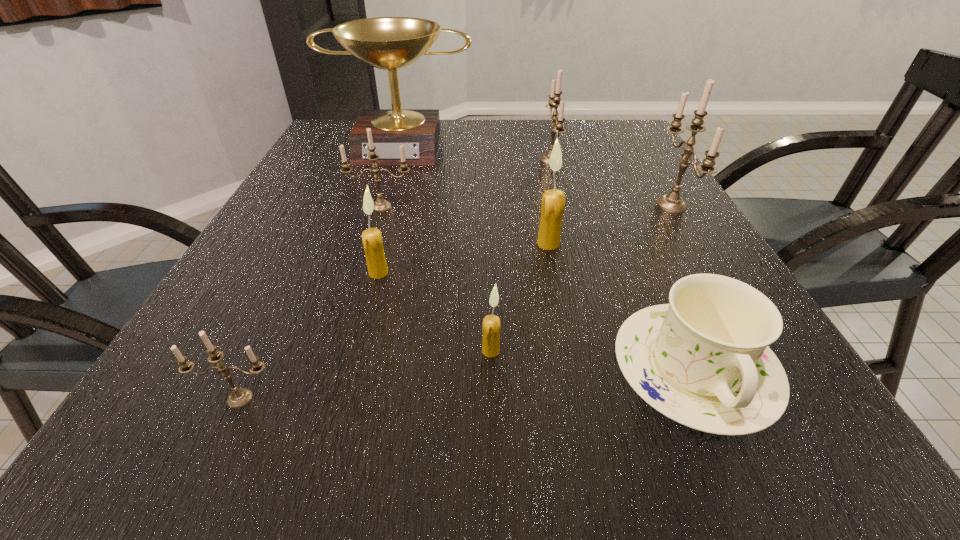
Where is `the sixth farthest candle`? This screenshot has height=540, width=960. the sixth farthest candle is located at coordinates (491, 323).

Identify the location of the fifth object from left to right. (491, 323).

Find the location of a particular element. This screenshot has height=540, width=960. the nearest metallic candle is located at coordinates (239, 397).

At what (x,y) coordinates should I click in order to perform the action: click on the smallest metallic candle. Please return your answer as a coordinate pair (x, y). The height and width of the screenshot is (540, 960). Looking at the image, I should click on (239, 397).

The width and height of the screenshot is (960, 540). In order to click on chinaware in this screenshot , I will do `click(703, 360)`.

At what (x,y) coordinates should I click in order to perform the action: click on vacant area situated 0.260m on the front-facing side of the award. Please return your answer as a coordinate pair (x, y). Looking at the image, I should click on (376, 222).

Where is `vacant space located on the left of the rightmost metallic candle`? The width and height of the screenshot is (960, 540). vacant space located on the left of the rightmost metallic candle is located at coordinates (532, 205).

You are a GUI agent. You are given a task and a screenshot of the screen. Output one action in this format:
    pyautogui.click(x=<x>, y=<y>)
    Task: Click on the free region located on the front of the third smallest metallic candle
    
    Given the screenshot: What is the action you would take?
    pyautogui.click(x=581, y=276)

You are a GUI agent. You are given a task and a screenshot of the screen. Output one action in this format:
    pyautogui.click(x=<x>, y=<y>)
    Task: Click on the free space located 0.380m on the front of the farthest cream candle
    The width and height of the screenshot is (960, 540).
    Given the screenshot: What is the action you would take?
    pyautogui.click(x=585, y=428)

I want to click on blank space located 0.210m on the left of the fourth nearest object, so click(254, 273).